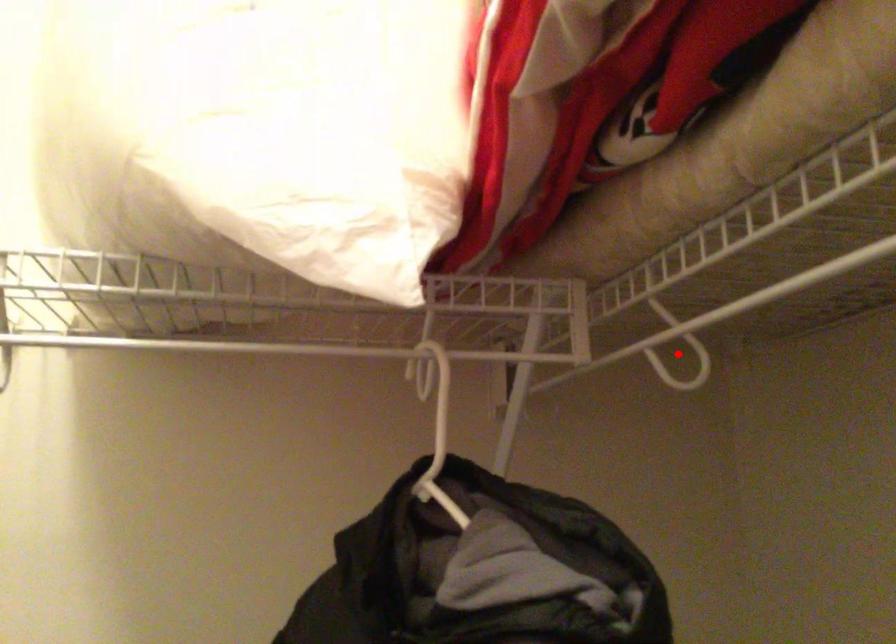
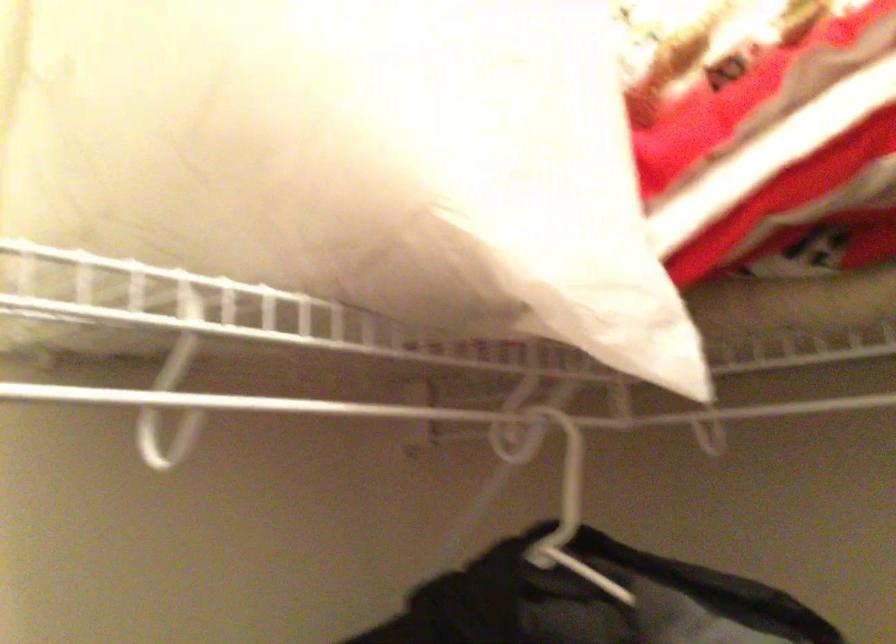
Question: I am providing you with two images of the same scene from different viewpoints. A red point is marked on the first image. At the location where the point appears in image 1, is it still visible in image 2?

Choices:
 (A) Yes
 (B) No

Answer: (B)